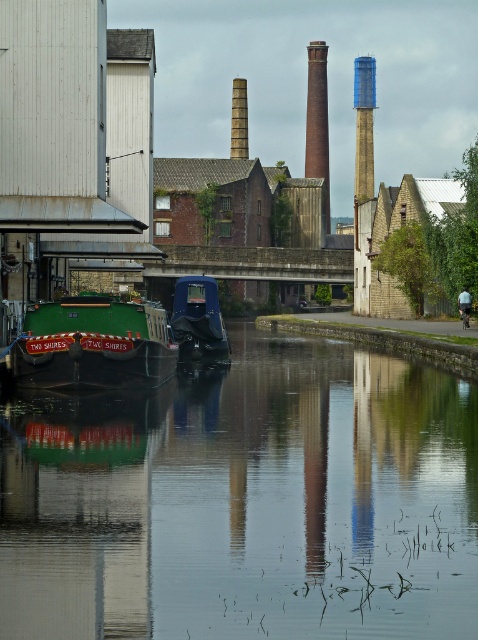
Question: Which object is positioned farthest from the green rubber boat at center?

Choices:
 (A) green matte barge at center
 (B) smooth brick chimney at center
 (C) blue painted brick chimney at center
 (D) red brick chimney at center

Answer: (D)

Question: Can you confirm if red brick chimney at center is wider than smooth brick chimney at center?

Choices:
 (A) yes
 (B) no

Answer: (A)

Question: Is green matte barge at center smaller than dark blue plastic boat at center?

Choices:
 (A) no
 (B) yes

Answer: (A)

Question: Which object appears closest to the camera in this image?

Choices:
 (A) green rubber boat at center
 (B) dark blue plastic boat at center
 (C) green matte barge at center
 (D) blue painted brick chimney at center

Answer: (A)

Question: Can you confirm if green rubber boat at center is positioned above blue painted brick chimney at center?

Choices:
 (A) no
 (B) yes

Answer: (A)

Question: Among these objects, which one is farthest from the camera?

Choices:
 (A) red brick chimney at center
 (B) green matte barge at center
 (C) smooth brick chimney at center
 (D) green rubber boat at center

Answer: (A)